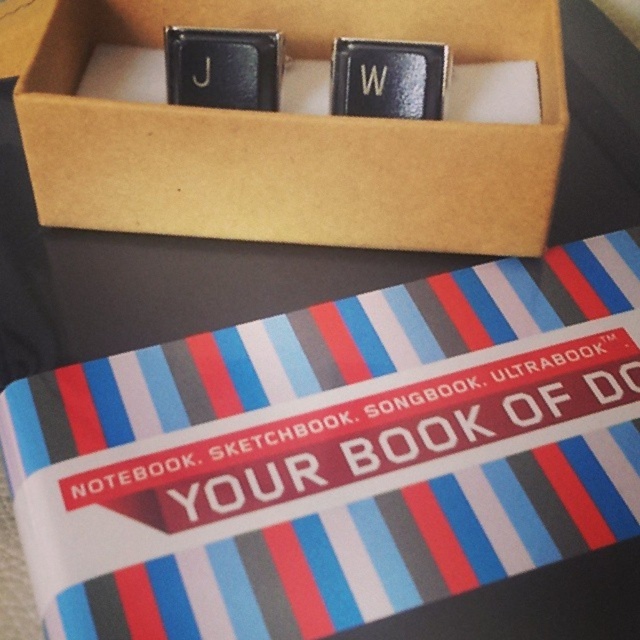
Question: Is striped paper notebook at center to the left of brown cardboard box at upper center from the viewer's perspective?

Choices:
 (A) yes
 (B) no

Answer: (B)

Question: Which point appears closest to the camera in this image?

Choices:
 (A) (515, 304)
 (B) (365, 164)

Answer: (B)

Question: Among these points, which one is nearest to the camera?

Choices:
 (A) (470, 284)
 (B) (330, 122)

Answer: (B)

Question: In this image, where is striped paper notebook at center located relative to brown cardboard box at upper center?

Choices:
 (A) below
 (B) above

Answer: (A)

Question: Among these objects, which one is farthest from the camera?

Choices:
 (A) striped paper notebook at center
 (B) brown cardboard box at upper center

Answer: (B)

Question: Is striped paper notebook at center bigger than brown cardboard box at upper center?

Choices:
 (A) no
 (B) yes

Answer: (B)